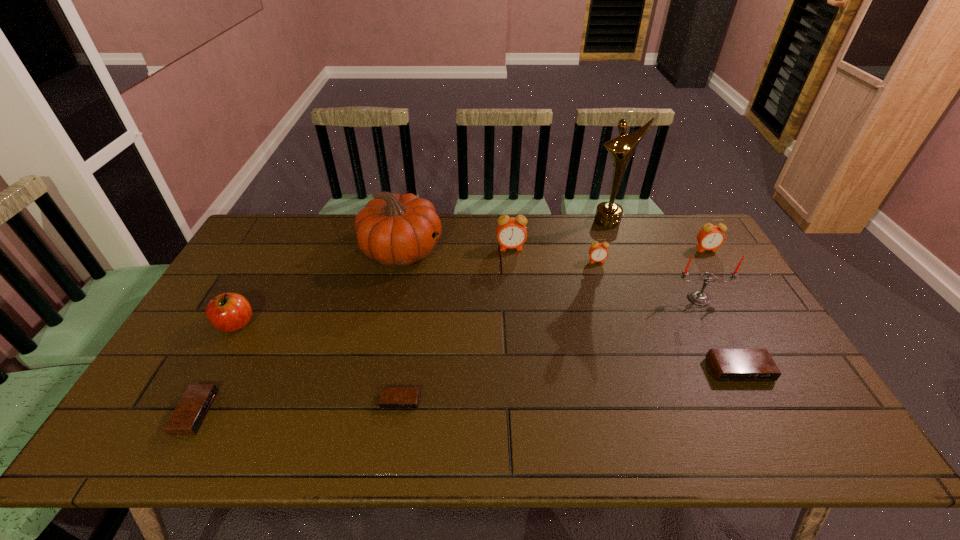
Locate an element on the screen. This screenshot has height=540, width=960. award is located at coordinates (608, 215).

You are a GUI agent. You are given a task and a screenshot of the screen. Output one action in this format:
    pyautogui.click(x=<x>, y=<y>)
    Task: Click on the pumpkin
    
    Given the screenshot: What is the action you would take?
    pyautogui.click(x=393, y=229)

Locate an element on the screen. the second tallest object is located at coordinates (393, 229).

This screenshot has height=540, width=960. Find the location of `candle`. candle is located at coordinates (698, 297).

Locate an element on the screen. The image size is (960, 540). red candle is located at coordinates (698, 297).

I want to click on the leftmost pink alarm clock, so pyautogui.click(x=511, y=232).

This screenshot has height=540, width=960. I want to click on the biggest pink alarm clock, so click(511, 232).

Locate an element on the screen. Image resolution: width=960 pixels, height=540 pixels. the rightmost pink alarm clock is located at coordinates (710, 237).

Locate an element on the screen. The height and width of the screenshot is (540, 960). the second biggest pink alarm clock is located at coordinates (710, 237).

You are a GUI agent. You are given a task and a screenshot of the screen. Output one action in this format:
    pyautogui.click(x=<x>, y=<y>)
    Task: Click on the apple
    
    Given the screenshot: What is the action you would take?
    pyautogui.click(x=228, y=312)